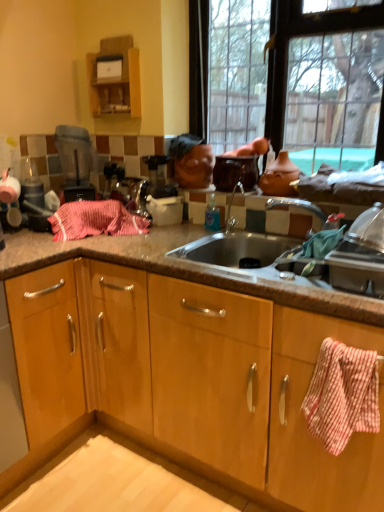
Question: Could glossy ceramic pot at upper center, which is counted as the 2th appliance, starting from the left, be considered to be inside wooden cabinet at upper left, which ranks as the first cabinetry in top-to-bottom order?

Choices:
 (A) yes
 (B) no

Answer: (B)

Question: Does wooden cabinet at upper left, the second cabinetry positioned from the bottom, have a greater width compared to glossy ceramic pot at upper center, the 1th appliance when ordered from right to left?

Choices:
 (A) no
 (B) yes

Answer: (A)

Question: Considering the relative sizes of wooden cabinet at upper left, the second cabinetry positioned from the bottom, and glossy ceramic pot at upper center, which is counted as the 2th appliance, starting from the left, in the image provided, is wooden cabinet at upper left, the second cabinetry positioned from the bottom, taller than glossy ceramic pot at upper center, which is counted as the 2th appliance, starting from the left,?

Choices:
 (A) yes
 (B) no

Answer: (A)

Question: Is wooden cabinet at upper left, the second cabinetry positioned from the bottom, smaller than glossy ceramic pot at upper center, the 1th appliance when ordered from right to left?

Choices:
 (A) no
 (B) yes

Answer: (B)

Question: Does wooden cabinet at upper left, which appears as the 2th cabinetry when viewed from the front, appear on the right side of glossy ceramic pot at upper center, which is counted as the 2th appliance, starting from the left?

Choices:
 (A) yes
 (B) no

Answer: (B)

Question: Considering the positions of matte black blender at upper left, which appears as the 2th appliance when viewed from the right, and wooden cabinet at upper left, which appears as the 2th cabinetry when viewed from the front, in the image, is matte black blender at upper left, which appears as the 2th appliance when viewed from the right, bigger or smaller than wooden cabinet at upper left, which appears as the 2th cabinetry when viewed from the front,?

Choices:
 (A) big
 (B) small

Answer: (A)

Question: Looking at their shapes, would you say matte black blender at upper left, which appears as the 2th appliance when viewed from the right, is wider or thinner than wooden cabinet at upper left, which ranks as the first cabinetry in top-to-bottom order?

Choices:
 (A) wide
 (B) thin

Answer: (A)

Question: Relative to wooden cabinet at upper left, acting as the first cabinetry starting from the back, is matte black blender at upper left, which appears as the 2th appliance when viewed from the right, in front or behind?

Choices:
 (A) front
 (B) behind

Answer: (A)

Question: Considering the relative positions of matte black blender at upper left, which appears as the 2th appliance when viewed from the right, and wooden cabinet at upper left, acting as the 1th cabinetry starting from the left, in the image provided, is matte black blender at upper left, which appears as the 2th appliance when viewed from the right, to the left or to the right of wooden cabinet at upper left, acting as the 1th cabinetry starting from the left,?

Choices:
 (A) left
 (B) right

Answer: (A)

Question: Is point (99, 81) closer or farther from the camera than point (64, 142)?

Choices:
 (A) closer
 (B) farther

Answer: (B)

Question: Is wooden cabinet at upper left, the second cabinetry positioned from the bottom, wider or thinner than matte black blender at upper left, which appears as the 2th appliance when viewed from the right?

Choices:
 (A) wide
 (B) thin

Answer: (B)

Question: Relative to matte black blender at upper left, the 1th appliance positioned from the left, is wooden cabinet at upper left, which appears as the 2th cabinetry when viewed from the front, in front or behind?

Choices:
 (A) front
 (B) behind

Answer: (B)

Question: Would you say wooden cabinet at upper left, the 2th cabinetry in the right-to-left sequence, is to the left or to the right of matte black blender at upper left, the 1th appliance positioned from the left, in the picture?

Choices:
 (A) right
 (B) left

Answer: (A)

Question: Does point (231, 165) appear closer or farther from the camera than point (380, 449)?

Choices:
 (A) farther
 (B) closer

Answer: (A)

Question: Is glossy ceramic pot at upper center, which is counted as the 2th appliance, starting from the left, inside or outside of red checkered towel at right, which is the second cabinetry from back to front?

Choices:
 (A) outside
 (B) inside

Answer: (A)